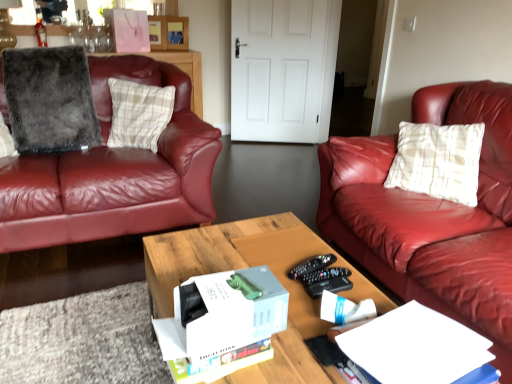
Locate an element on the screen. The height and width of the screenshot is (384, 512). free space above white cardboard box at center (from a real-world perspective) is located at coordinates (229, 292).